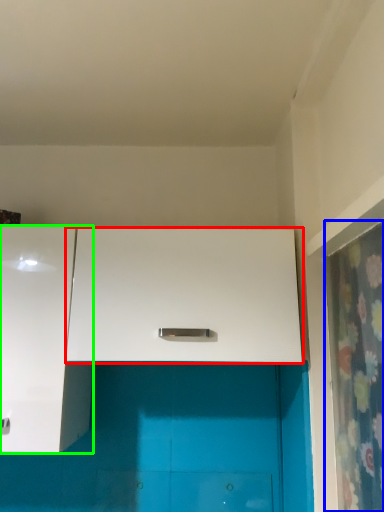
Question: Which object is positioned closest to cabinetry (highlighted by a red box)? Select from shower curtain (highlighted by a blue box) and cabinetry (highlighted by a green box).

Choices:
 (A) shower curtain
 (B) cabinetry

Answer: (B)